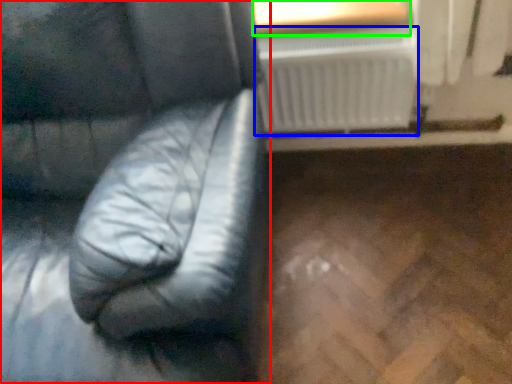
Question: Considering the real-world distances, which object is farthest from furniture (highlighted by a red box)? radiator (highlighted by a blue box) or window frame (highlighted by a green box)?

Choices:
 (A) radiator
 (B) window frame

Answer: (B)